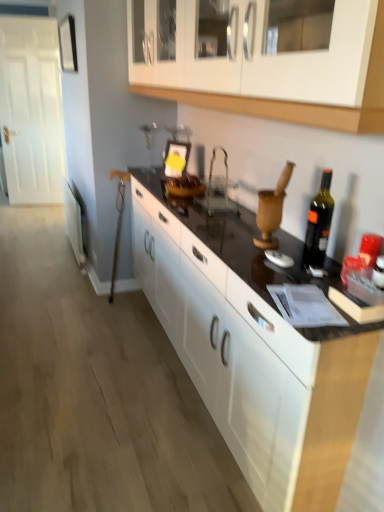
You are a GUI agent. You are given a task and a screenshot of the screen. Output one action in this format:
    pyautogui.click(x=<x>, y=<y>)
    Task: Click on the white glossy cabinet at upper center
    The height and width of the screenshot is (512, 384).
    Given the screenshot: What is the action you would take?
    pyautogui.click(x=299, y=102)

I want to click on black glossy countertop at center, so click(262, 358).

Identify the location of countertop below the black glass bottle at right (from a real-world perspective). The width and height of the screenshot is (384, 512). (262, 358).

Does point (319, 354) appear closer or farther from the camera than point (306, 253)?

Point (319, 354) appears to be closer to the viewer than point (306, 253).

Considering the sizes of objects black glossy countertop at center and black glass bottle at right in the image provided, who is thinner, black glossy countertop at center or black glass bottle at right?

Thinner between the two is black glass bottle at right.

Is white glossy cabinet at upper center spatially inside black glossy countertop at center, or outside of it?

white glossy cabinet at upper center is outside black glossy countertop at center.

From the image's perspective, is white glossy cabinet at upper center above or below black glossy countertop at center?

Based on their image positions, white glossy cabinet at upper center is located above black glossy countertop at center.

Based on the photo, is white glossy cabinet at upper center aimed at black glossy countertop at center?

No, white glossy cabinet at upper center is not aimed at black glossy countertop at center.

Locate an element on the screen. countertop that is on the right side of white glossy cabinet at upper center is located at coordinates (262, 358).

From the image's perspective, which one is positioned higher, white glossy cabinet at upper center or black glass bottle at right?

From the image's view, white glossy cabinet at upper center is above.

Locate an element on the screen. The height and width of the screenshot is (512, 384). bottle beneath the white glossy cabinet at upper center (from a real-world perspective) is located at coordinates (319, 223).

Looking at this image, is white glossy cabinet at upper center facing towards black glass bottle at right?

No, white glossy cabinet at upper center is not facing towards black glass bottle at right.

Based on the photo, can you confirm if black glass bottle at right is thinner than white glossy cabinet at upper center?

Yes, black glass bottle at right is thinner than white glossy cabinet at upper center.

Looking at the image, does black glass bottle at right seem bigger or smaller compared to white glossy cabinet at upper center?

In the image, black glass bottle at right appears to be smaller than white glossy cabinet at upper center.

Could you tell me if black glass bottle at right is facing white glossy cabinet at upper center?

No, black glass bottle at right is not turned towards white glossy cabinet at upper center.

Considering the relative sizes of black glass bottle at right and white glossy cabinet at upper center in the image provided, is black glass bottle at right taller than white glossy cabinet at upper center?

Incorrect, the height of black glass bottle at right is not larger of that of white glossy cabinet at upper center.

Based on the photo, is black glossy countertop at center turned away from white glossy cabinet at upper center?

No.

The image size is (384, 512). I want to click on countertop that is under the white glossy cabinet at upper center (from a real-world perspective), so click(262, 358).

Would you say black glossy countertop at center is outside white glossy cabinet at upper center?

Yes, black glossy countertop at center is located beyond the bounds of white glossy cabinet at upper center.

From the image's perspective, is black glossy countertop at center located above white glossy cabinet at upper center?

No, from the image's perspective, black glossy countertop at center is not over white glossy cabinet at upper center.

Could you tell me if black glass bottle at right is facing black glossy countertop at center?

No, black glass bottle at right is not facing towards black glossy countertop at center.

Is black glass bottle at right closer to the viewer compared to black glossy countertop at center?

Result: No, it is not.

Between black glass bottle at right and black glossy countertop at center, which one appears on the left side from the viewer's perspective?

Positioned to the left is black glossy countertop at center.

Is black glass bottle at right spatially inside black glossy countertop at center, or outside of it?

black glass bottle at right is not inside black glossy countertop at center, it's outside.

At what (x,y) coordinates should I click in order to perform the action: click on bottle above the black glossy countertop at center (from the image's perspective). Please return your answer as a coordinate pair (x, y). Looking at the image, I should click on (319, 223).

Locate an element on the screen. This screenshot has width=384, height=512. cabinetry above the black glossy countertop at center (from a real-world perspective) is located at coordinates (299, 102).

Considering their positions, is black glass bottle at right positioned closer to black glossy countertop at center than white glossy cabinet at upper center?

Based on the image, black glass bottle at right appears to be nearer to black glossy countertop at center.

Which object lies further to the anchor point black glossy countertop at center, white glossy cabinet at upper center or black glass bottle at right?

white glossy cabinet at upper center is positioned further to the anchor black glossy countertop at center.

Estimate the real-world distances between objects in this image. Which object is closer to white glossy cabinet at upper center, black glass bottle at right or black glossy countertop at center?

black glass bottle at right lies closer to white glossy cabinet at upper center than the other object.

Based on their spatial positions, is white glossy cabinet at upper center or black glossy countertop at center further from black glass bottle at right?

The object further to black glass bottle at right is white glossy cabinet at upper center.

Looking at this image, based on their spatial positions, is black glossy countertop at center or black glass bottle at right closer to white glossy cabinet at upper center?

black glass bottle at right is closer to white glossy cabinet at upper center.

Which object lies nearer to the anchor point black glass bottle at right, black glossy countertop at center or white glossy cabinet at upper center?

black glossy countertop at center is positioned closer to the anchor black glass bottle at right.

Find the location of a particular element. bottle between white glossy cabinet at upper center and black glossy countertop at center in the vertical direction is located at coordinates (319, 223).